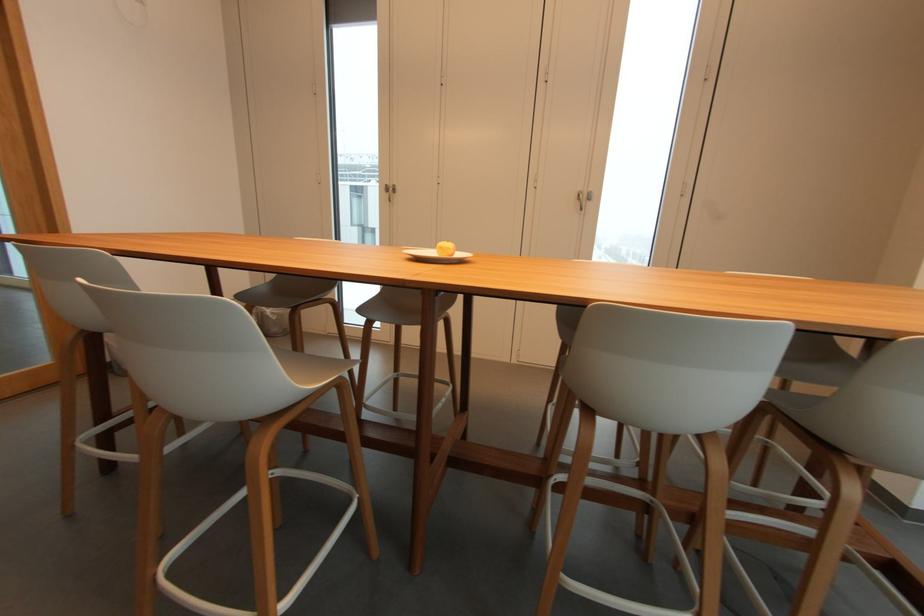
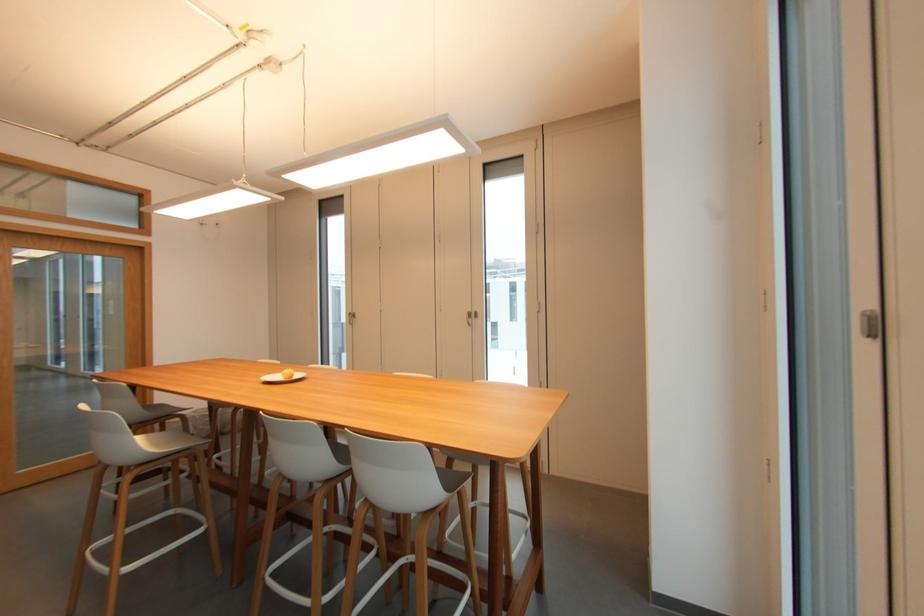
Find the pixel in the second image that matches point (585, 188) in the first image.

(473, 310)